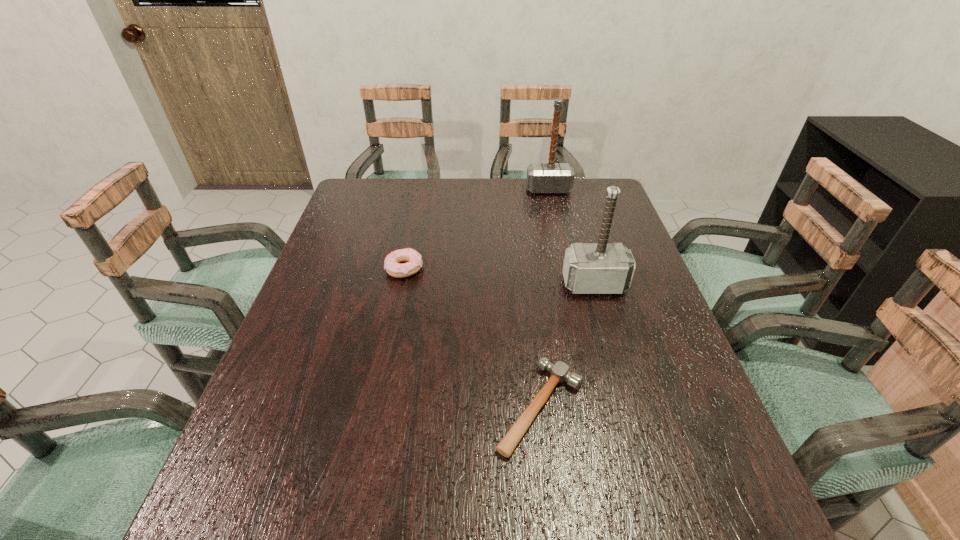
Image resolution: width=960 pixels, height=540 pixels. I want to click on blank region between the farthest hammer and the second nearest hammer, so click(x=571, y=237).

At what (x,y) coordinates should I click in order to perform the action: click on vacant area that lies between the second nearest hammer and the doughnut. Please return your answer as a coordinate pair (x, y). Looking at the image, I should click on (499, 276).

In order to click on vacant area that lies between the second nearest hammer and the shortest hammer in this screenshot , I will do `click(567, 346)`.

Identify the location of empty space between the doughnut and the second farthest hammer. point(499,276).

Identify the location of vacant region between the shortest hammer and the doughnut. (472, 338).

The image size is (960, 540). I want to click on blank region between the farthest hammer and the second farthest hammer, so click(x=571, y=237).

Find the location of a particular element. The image size is (960, 540). object that is the second closest to the second farthest hammer is located at coordinates (413, 259).

Find the location of a particular element. object that is the second closest one to the second nearest hammer is located at coordinates (413, 259).

Find the location of a particular element. the second closest hammer to the shortest object is located at coordinates click(x=551, y=177).

Identify which hammer is the closest to the third tallest object. Please provide its 2D coordinates. Your answer should be formatted as a tuple, i.e. [(x, y)], where the tuple contains the x and y coordinates of a point satisfying the conditions above.

[(559, 372)]